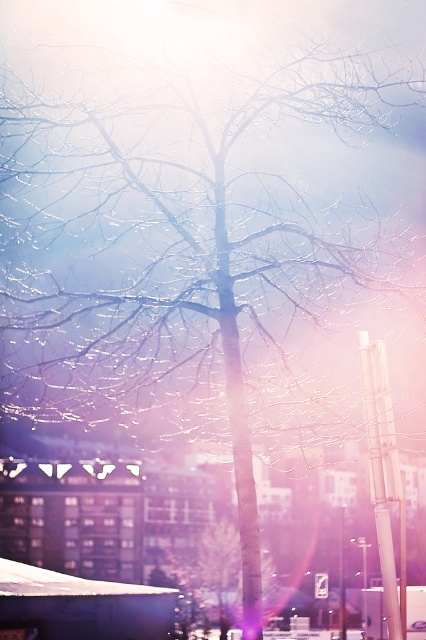
Question: From the image, what is the correct spatial relationship of white glossy pole at right in relation to smooth bark tree at center?

Choices:
 (A) above
 (B) below

Answer: (A)

Question: Which point appears closest to the camera in this image?

Choices:
 (A) (213, 604)
 (B) (389, 422)

Answer: (B)

Question: Does white glossy pole at right have a smaller size compared to smooth bark tree at center?

Choices:
 (A) yes
 (B) no

Answer: (A)

Question: Does white glossy pole at right appear under smooth bark tree at center?

Choices:
 (A) no
 (B) yes

Answer: (A)